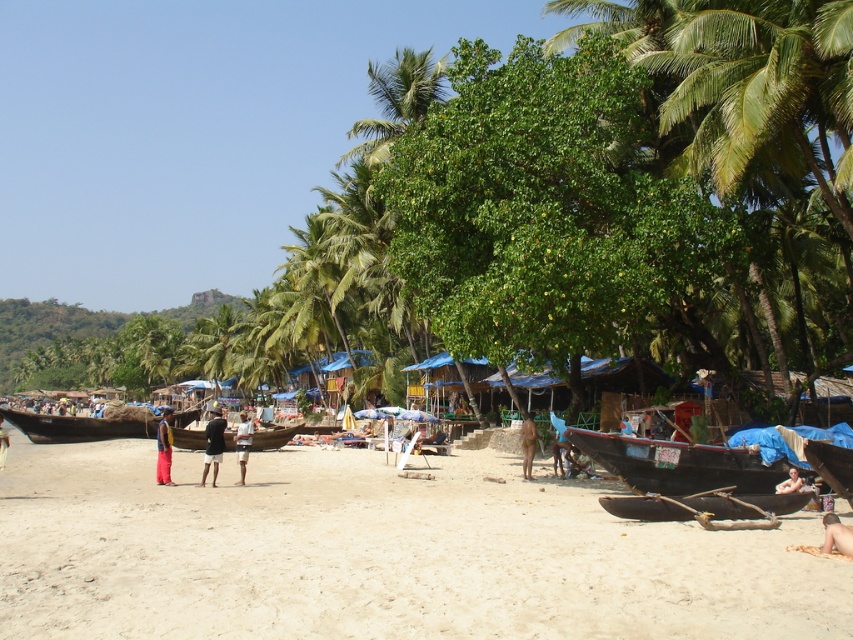
Between brown wooden canoe at lower right and light brown fabric shorts at center, which one has more height?

Standing taller between the two is light brown fabric shorts at center.

Which is behind, point (692, 497) or point (242, 465)?

Positioned behind is point (242, 465).

Where is `brown wooden canoe at lower right`? brown wooden canoe at lower right is located at coordinates (703, 506).

Between point (715, 493) and point (160, 452), which one is positioned behind?

The point (160, 452) is behind.

From the picture: Can you confirm if brown wooden canoe at lower right is shorter than yellow fabric pants at center?

Yes, brown wooden canoe at lower right is shorter than yellow fabric pants at center.

Is point (778, 506) in front of point (165, 472)?

Yes, point (778, 506) is in front of point (165, 472).

Where is `brown wooden canoe at lower right`? brown wooden canoe at lower right is located at coordinates (703, 506).

Between dark brown wooden boat at lower right and dark brown leather shorts at center, which one is positioned lower?

Positioned lower is dark brown leather shorts at center.

This screenshot has height=640, width=853. Identify the location of dark brown wooden boat at lower right. (680, 464).